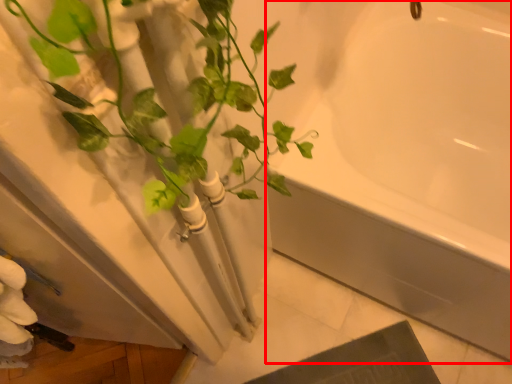
Question: Considering the relative positions of bathtub (annotated by the red box) and houseplant in the image provided, where is bathtub (annotated by the red box) located with respect to the staircase?

Choices:
 (A) left
 (B) right

Answer: (B)